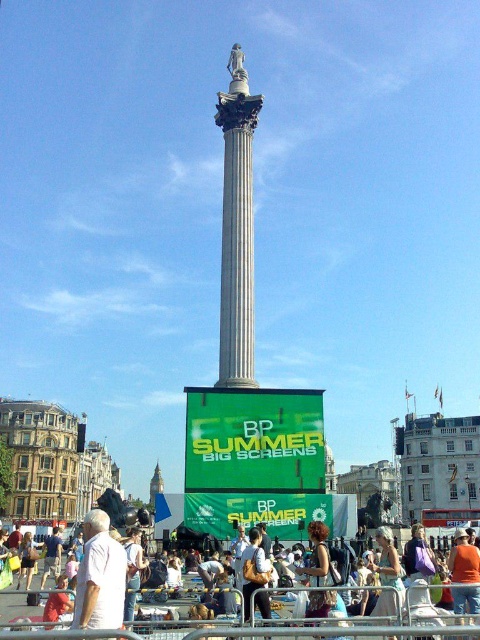
You are a photographer trying to capture a clear photo of the orange fabric shirt at center without the white marble column at center blocking it. Based on the scene, what adjustment could you make to your position to achieve this?

The orange fabric shirt at center is behind the white marble column at center. To capture the shirt without the column blocking it, move to a position where you can see around or behind the column, such as shifting to the side or moving closer to adjust your angle so the column no longer obstructs the view of the shirt.

You are standing at the base of Nelsons Column in London and notice a white cotton shirt at lower center. Where exactly is the white cotton shirt positioned relative to the monument?

The white cotton shirt at lower center is positioned at coordinates point (93, 588) relative to the monument.

You are a photographer trying to capture a candid shot of the two shirts displayed at the urban monument. The camera you are using has a limited frame width. Which shirt, the white cotton shirt at lower center or the orange fabric shirt at center, would you focus on to ensure it fits entirely within the frame if the frame can only accommodate the narrower of the two?

Answer: The orange fabric shirt at center is narrower than the white cotton shirt at lower center, so focusing on the orange fabric shirt at center would ensure it fits entirely within the frame.